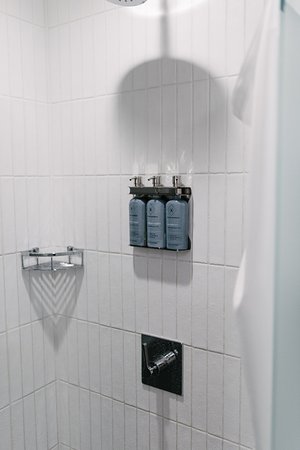
Identify the location of shower handle. (154, 366).